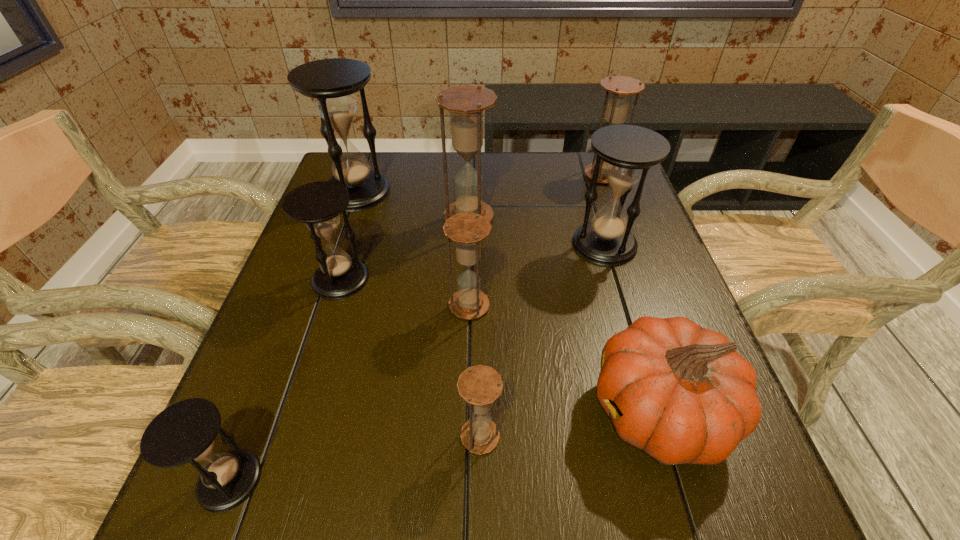
Where is `free location located 0.190m on the back of the second farthest brown hourglass`? This screenshot has height=540, width=960. free location located 0.190m on the back of the second farthest brown hourglass is located at coordinates (470, 165).

Find the location of `free point located on the right of the farthest black hourglass`. free point located on the right of the farthest black hourglass is located at coordinates (501, 192).

This screenshot has width=960, height=540. Find the location of `free space located on the left of the farthest brown hourglass`. free space located on the left of the farthest brown hourglass is located at coordinates (564, 175).

Locate an element on the screen. This screenshot has width=960, height=540. vacant space located 0.060m on the back of the rightmost black hourglass is located at coordinates (594, 211).

Find the location of a particular element. This screenshot has width=960, height=540. vacant space located on the back of the third biggest black hourglass is located at coordinates (373, 174).

I want to click on free space located on the back of the third biggest brown hourglass, so click(x=470, y=256).

Where is `vacant space located on the face of the orange pumpkin`? This screenshot has height=540, width=960. vacant space located on the face of the orange pumpkin is located at coordinates [537, 411].

Where is `blank space located on the face of the orange pumpkin`? The height and width of the screenshot is (540, 960). blank space located on the face of the orange pumpkin is located at coordinates (444, 411).

Identify the location of blank space located 0.320m on the face of the orange pumpkin. Image resolution: width=960 pixels, height=540 pixels. (403, 411).

At what (x,y) coordinates should I click in order to perform the action: click on vacant point located on the left of the nearest brown hourglass. Please return your answer as a coordinate pair (x, y). The height and width of the screenshot is (540, 960). Looking at the image, I should click on (315, 436).